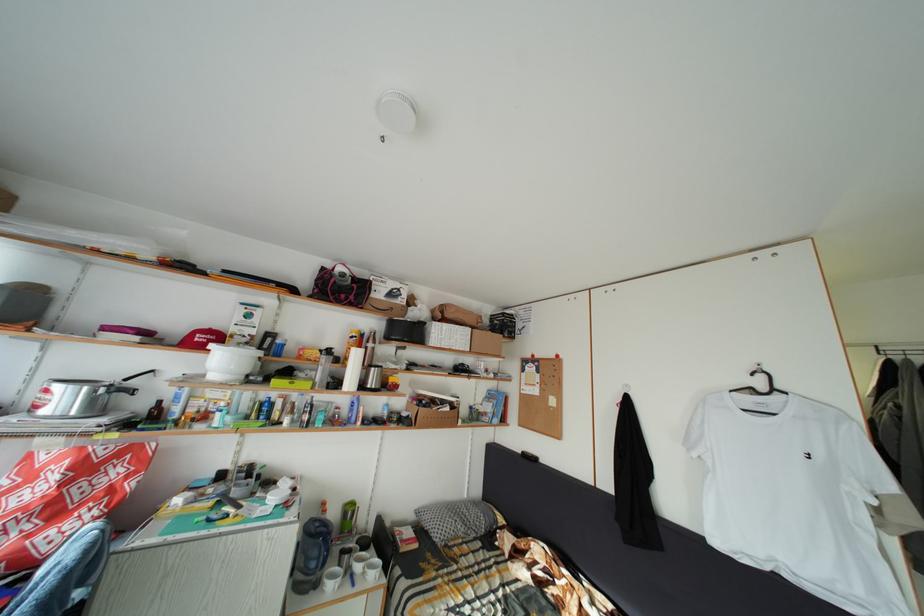
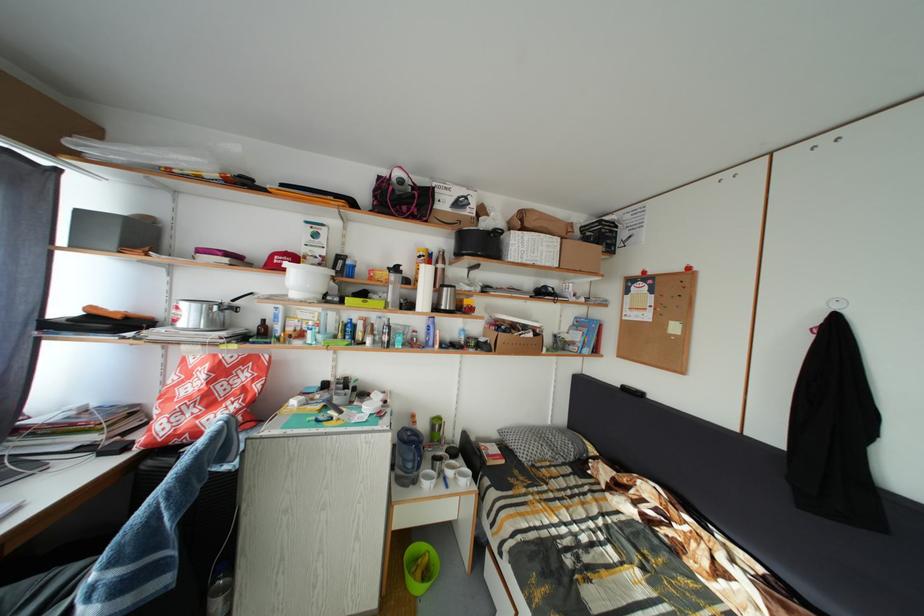
Where in the second image is the point corresponding to (207,342) from the first image?

(285, 264)